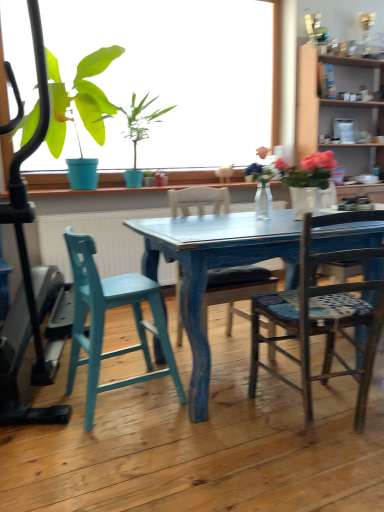
Question: Considering the relative sizes of wooden chair at center, which appears as the second chair when viewed from the left, and teal wood stool at left, which ranks as the 1th chair in left-to-right order, in the image provided, is wooden chair at center, which appears as the second chair when viewed from the left, thinner than teal wood stool at left, which ranks as the 1th chair in left-to-right order,?

Choices:
 (A) no
 (B) yes

Answer: (A)

Question: Can you confirm if wooden chair at center, which appears as the second chair when viewed from the left, is wider than teal wood stool at left, which appears as the 3th chair when viewed from the right?

Choices:
 (A) no
 (B) yes

Answer: (B)

Question: Is wooden chair at center, the second chair in the right-to-left sequence, oriented towards teal wood stool at left, which ranks as the 1th chair in left-to-right order?

Choices:
 (A) yes
 (B) no

Answer: (B)

Question: Is wooden chair at center, which appears as the second chair when viewed from the left, smaller than teal wood stool at left, which appears as the 3th chair when viewed from the right?

Choices:
 (A) yes
 (B) no

Answer: (B)

Question: Does wooden chair at center, which appears as the second chair when viewed from the left, have a larger size compared to teal wood stool at left, which appears as the 3th chair when viewed from the right?

Choices:
 (A) no
 (B) yes

Answer: (B)

Question: From the image's perspective, relative to matte white mug at upper center, is wooden cabinet at upper right above or below?

Choices:
 (A) above
 (B) below

Answer: (B)

Question: In terms of height, does wooden cabinet at upper right look taller or shorter compared to matte white mug at upper center?

Choices:
 (A) short
 (B) tall

Answer: (B)

Question: In terms of width, does wooden cabinet at upper right look wider or thinner when compared to matte white mug at upper center?

Choices:
 (A) wide
 (B) thin

Answer: (A)

Question: Would you say wooden cabinet at upper right is inside or outside matte white mug at upper center?

Choices:
 (A) inside
 (B) outside

Answer: (B)

Question: Looking at their shapes, would you say matte white mug at upper center is wider or thinner than wooden cabinet at upper right?

Choices:
 (A) wide
 (B) thin

Answer: (B)

Question: From a real-world perspective, is matte white mug at upper center positioned above or below wooden cabinet at upper right?

Choices:
 (A) above
 (B) below

Answer: (A)

Question: Is point (352, 142) closer or farther from the camera than point (334, 69)?

Choices:
 (A) closer
 (B) farther

Answer: (B)

Question: In terms of size, does matte white mug at upper center appear bigger or smaller than wooden cabinet at upper right?

Choices:
 (A) big
 (B) small

Answer: (B)

Question: Considering the positions of green matte plant at upper left and wooden cabinet at upper right in the image, is green matte plant at upper left wider or thinner than wooden cabinet at upper right?

Choices:
 (A) thin
 (B) wide

Answer: (B)

Question: Does point (29, 121) appear closer or farther from the camera than point (302, 144)?

Choices:
 (A) farther
 (B) closer

Answer: (B)